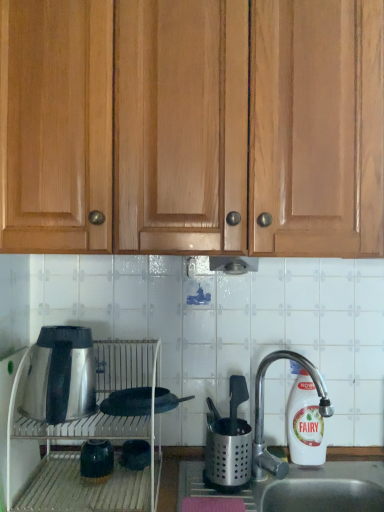
Question: Is matte green vase at lower left, which appears as the second appliance when viewed from the top, wider or thinner than matte black pot at lower center, which is the 1th appliance in bottom-to-top order?

Choices:
 (A) wide
 (B) thin

Answer: (B)

Question: Is matte green vase at lower left, which appears as the second appliance when viewed from the top, to the left or to the right of matte black pot at lower center, positioned as the third appliance in top-to-bottom order, in the image?

Choices:
 (A) right
 (B) left

Answer: (B)

Question: Estimate the real-world distances between objects in this image. Which object is closer to the silver metallic faucet at right?

Choices:
 (A) satin silver exhaust hood at center
 (B) shiny metallic kettle at left
 (C) white plastic bottle at right
 (D) satin silver oven at lower left
 (E) light brown wood cabinets at upper center

Answer: (C)

Question: Based on their relative distances, which object is farther from the light brown wood cabinets at upper center?

Choices:
 (A) shiny metallic kettle at left
 (B) white plastic bottle at right
 (C) black matte frying pan at center, the third appliance in the bottom-to-top sequence
 (D) silver metallic faucet at right
 (E) satin silver oven at lower left

Answer: (B)